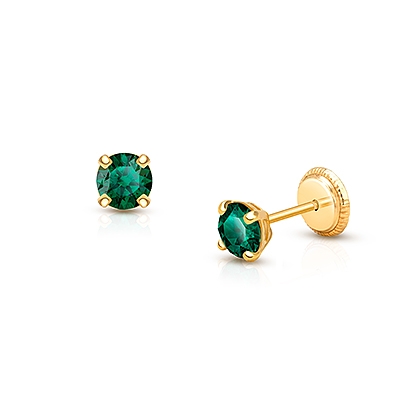
Locate an element on the screen. This screenshot has height=402, width=402. jewel holder is located at coordinates [x=266, y=235].